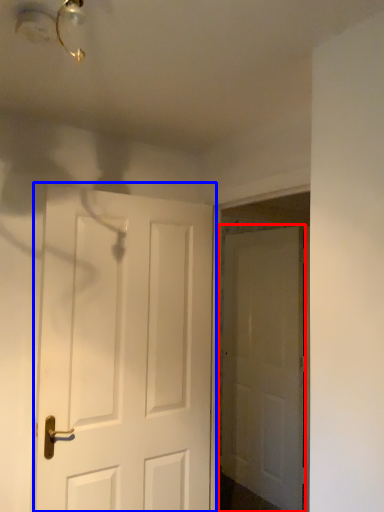
Question: Which object appears farthest to the camera in this image, door (highlighted by a red box) or door (highlighted by a blue box)?

Choices:
 (A) door
 (B) door

Answer: (A)